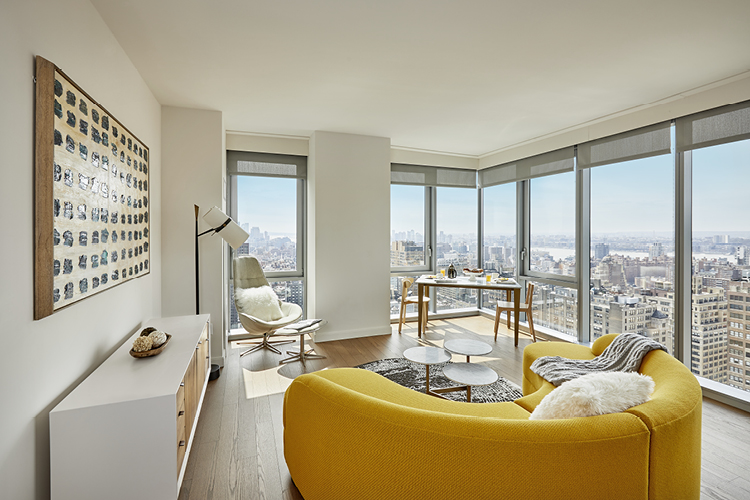
Image resolution: width=750 pixels, height=500 pixels. Identify the location of hung picture. (94, 216).